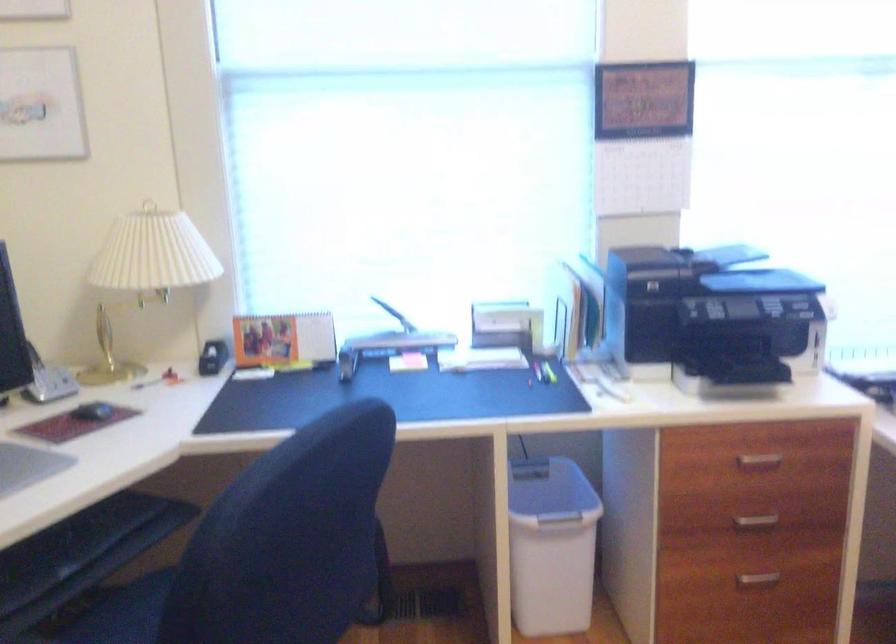
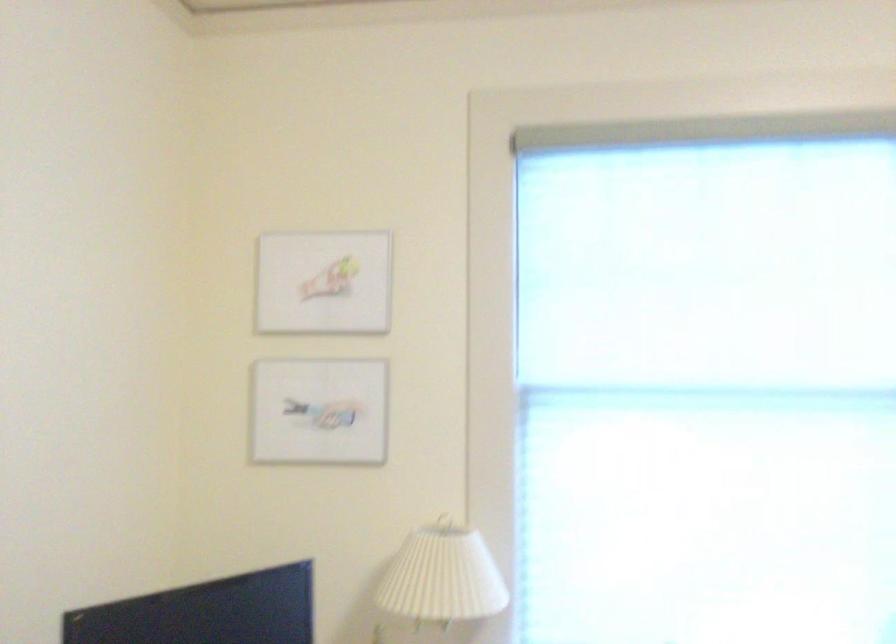
Where in the second image is the point corresponding to [152,252] from the first image?

(443, 576)